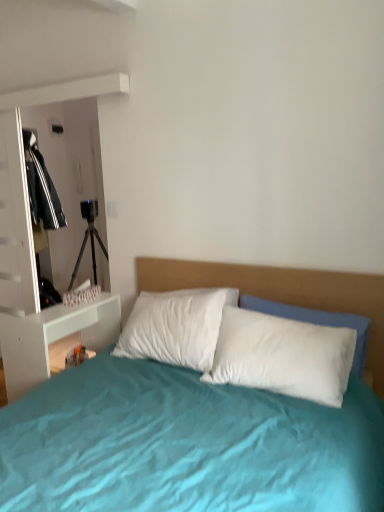
Question: Can you confirm if white glossy nightstand at left is bigger than white soft pillow at center?

Choices:
 (A) no
 (B) yes

Answer: (B)

Question: Is white glossy nightstand at left outside of white soft pillow at center?

Choices:
 (A) yes
 (B) no

Answer: (A)

Question: From a real-world perspective, is white glossy nightstand at left positioned under white soft pillow at center based on gravity?

Choices:
 (A) no
 (B) yes

Answer: (B)

Question: From the image's perspective, is white glossy nightstand at left located above white soft pillow at center?

Choices:
 (A) yes
 (B) no

Answer: (B)

Question: Are white glossy nightstand at left and white soft pillow at center located far from each other?

Choices:
 (A) yes
 (B) no

Answer: (A)

Question: Considering the relative sizes of white glossy nightstand at left and white soft pillow at center in the image provided, is white glossy nightstand at left smaller than white soft pillow at center?

Choices:
 (A) no
 (B) yes

Answer: (A)

Question: From a real-world perspective, does white soft pillow at center sit lower than white glossy nightstand at left?

Choices:
 (A) no
 (B) yes

Answer: (A)

Question: Is white soft pillow at center outside of white glossy nightstand at left?

Choices:
 (A) yes
 (B) no

Answer: (A)

Question: From a real-world perspective, is white soft pillow at center over white glossy nightstand at left?

Choices:
 (A) no
 (B) yes

Answer: (B)

Question: Is white glossy nightstand at left a part of white soft pillow at center?

Choices:
 (A) yes
 (B) no

Answer: (B)

Question: Considering the relative sizes of white soft pillow at center and white glossy nightstand at left in the image provided, is white soft pillow at center smaller than white glossy nightstand at left?

Choices:
 (A) no
 (B) yes

Answer: (B)

Question: Can you confirm if white soft pillow at center is thinner than white glossy nightstand at left?

Choices:
 (A) no
 (B) yes

Answer: (B)

Question: In terms of width, does white glossy nightstand at left look wider or thinner when compared to white soft pillow at center?

Choices:
 (A) wide
 (B) thin

Answer: (A)